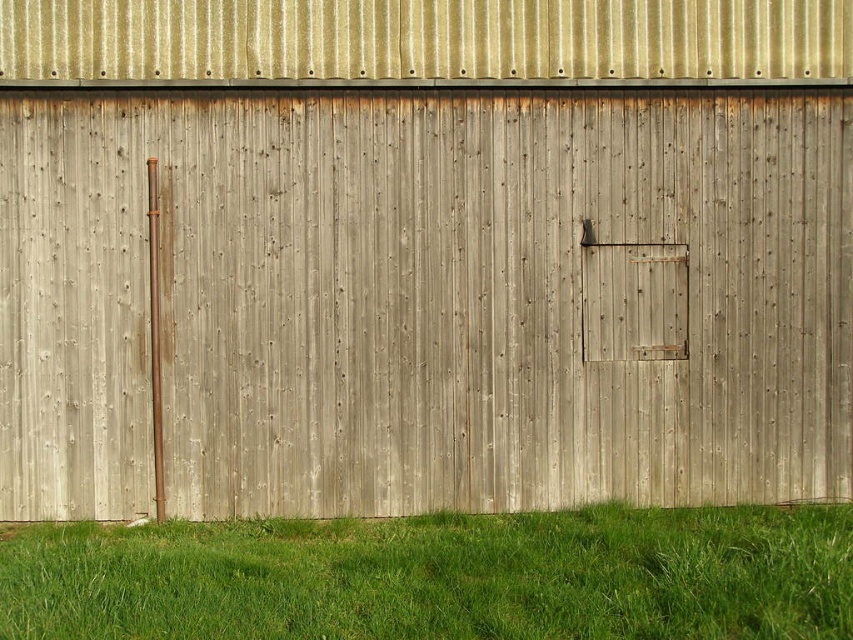
You are a painter who needs to know the relative sizes of the weathered wood door at center and the green grass at lower center to estimate materials. Which object is wider?

The weathered wood door at center is wider than the green grass at lower center according to the description.

You are standing 1.7 meters tall and want to reach the point at point (525,150). Can you reach it without any tools?

The point at point (525,150) is 8.97 meters away from you, so you cannot reach it without any tools.

You are a maintenance worker inspecting the building. You notice the weathered wood door at center and the green grass at lower center. Which object is positioned higher up on the wall?

The weathered wood door at center is located above green grass at lower center, so it is positioned higher up on the wall.